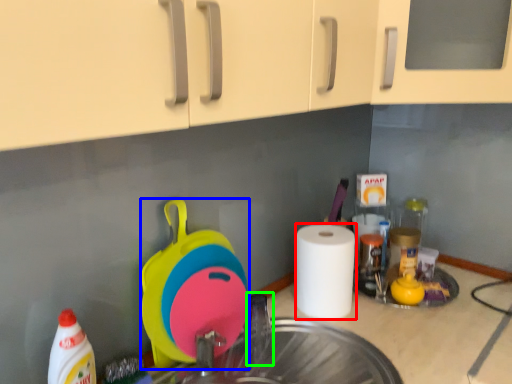
Question: Based on their relative distances, which object is nearer to paper towel (highlighted by a red box)? Choose from appliance (highlighted by a blue box) and faucet (highlighted by a green box).

Choices:
 (A) appliance
 (B) faucet

Answer: (B)